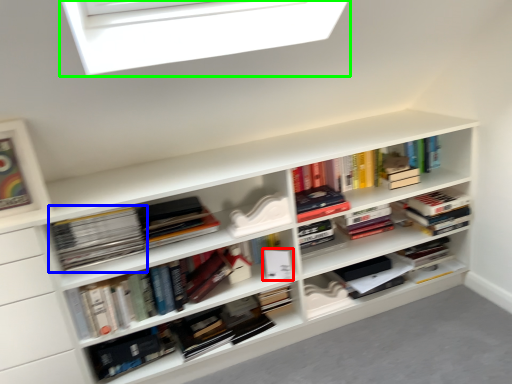
Question: Which object is the closest to the paperback book (highlighted by a red box)? Choose among these: book (highlighted by a blue box) or window (highlighted by a green box).

Choices:
 (A) book
 (B) window

Answer: (A)